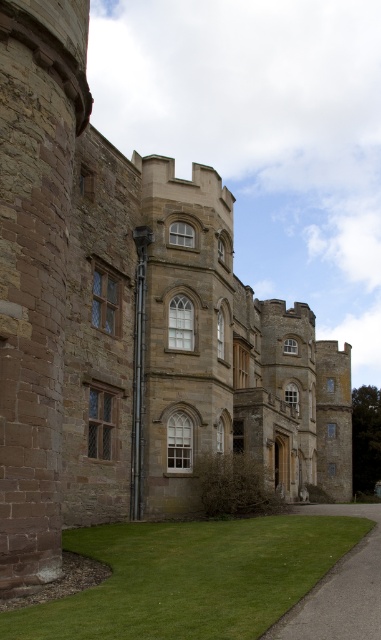
Is point (222, 616) farther from camera compared to point (369, 595)?

No, it is in front of (369, 595).

Does green grass at lower center appear on the right side of gray asphalt driveway at lower right?

Incorrect, green grass at lower center is not on the right side of gray asphalt driveway at lower right.

Locate an element on the screen. Image resolution: width=381 pixels, height=640 pixels. green grass at lower center is located at coordinates (190, 579).

This screenshot has height=640, width=381. Find the location of `green grass at lower center`. green grass at lower center is located at coordinates (190, 579).